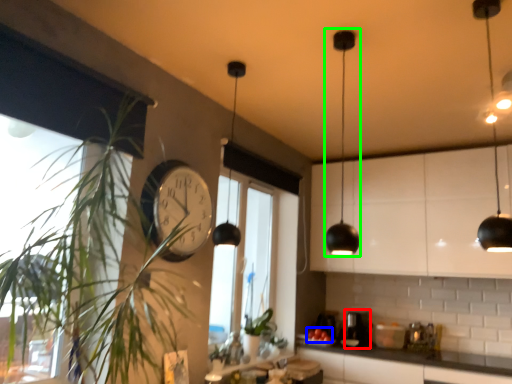
Question: Which is farther away from coffee machine (highlighted by a red box)? fruit (highlighted by a blue box) or light (highlighted by a green box)?

Choices:
 (A) fruit
 (B) light

Answer: (B)